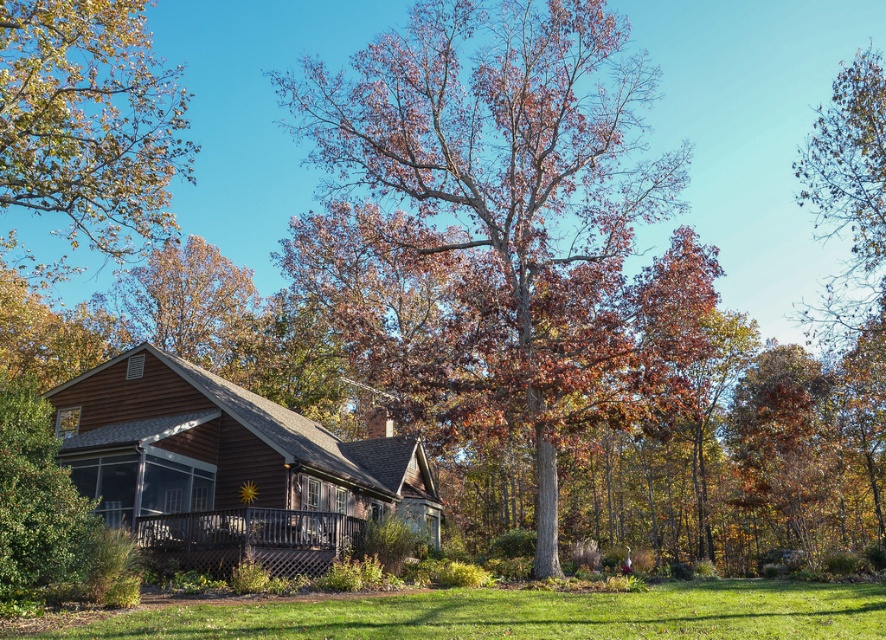
Question: Which point is farther to the camera?

Choices:
 (A) (94, 246)
 (B) (183, 618)
 (C) (285, 483)
 (D) (595, 304)

Answer: (A)

Question: Estimate the real-world distances between objects in this image. Which object is farther from the brown wood cabin at center?

Choices:
 (A) green grass at lower center
 (B) brown textured tree at center
 (C) green leafy tree at upper left

Answer: (C)

Question: Among these points, which one is nearest to the camera?

Choices:
 (A) (36, 76)
 (B) (443, 24)

Answer: (A)

Question: From the image, what is the correct spatial relationship of green leafy tree at upper left in relation to green grass at lower center?

Choices:
 (A) right
 (B) left

Answer: (B)

Question: Does brown wood cabin at center have a lesser width compared to green leafy tree at upper left?

Choices:
 (A) yes
 (B) no

Answer: (A)

Question: Can you confirm if brown textured tree at center is thinner than brown wood cabin at center?

Choices:
 (A) no
 (B) yes

Answer: (A)